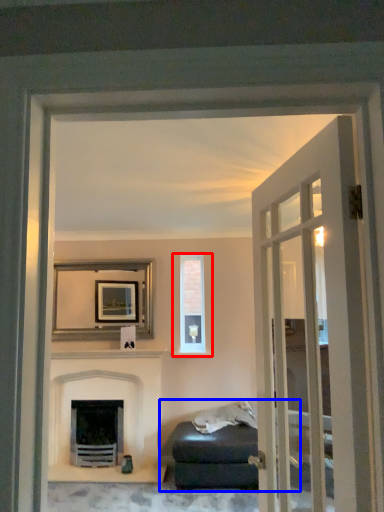
Question: Among these objects, which one is farthest to the camera, window (highlighted by a red box) or studio couch (highlighted by a blue box)?

Choices:
 (A) window
 (B) studio couch

Answer: (A)